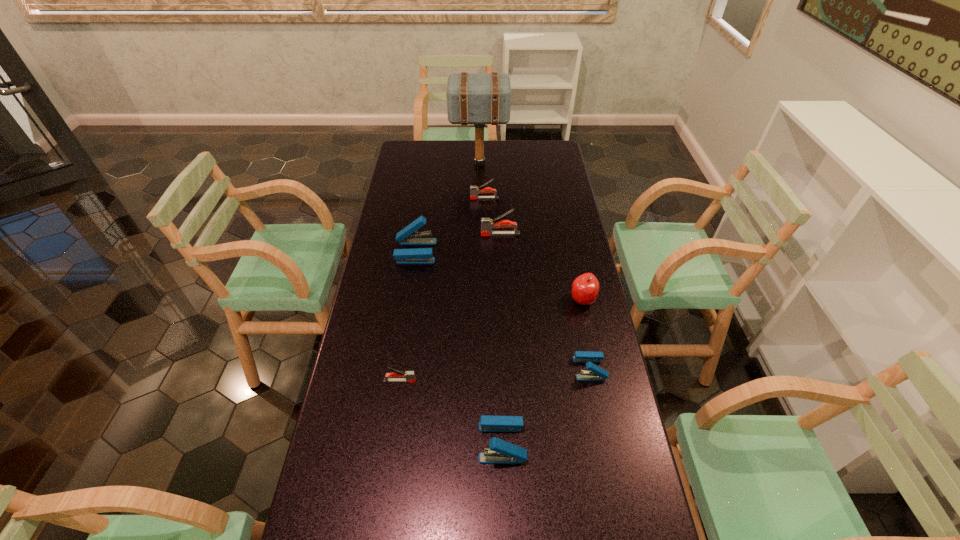
The image size is (960, 540). Identify the location of vacant space in between the second nearest blue stapler and the farthest object. (535, 266).

The width and height of the screenshot is (960, 540). Find the location of `vacant space that's between the smallest gray stapler and the tallest object`. vacant space that's between the smallest gray stapler and the tallest object is located at coordinates click(x=440, y=273).

Locate an element on the screen. unoccupied position between the third farthest stapler and the farthest stapler is located at coordinates (450, 225).

Identify which object is the closest to the second smallest blue stapler. Please provide its 2D coordinates. Your answer should be formatted as a tuple, i.e. [(x, y)], where the tuple contains the x and y coordinates of a point satisfying the conditions above.

[(596, 373)]

Select which object appears as the second closest to the fifth nearest stapler. Please provide its 2D coordinates. Your answer should be formatted as a tuple, i.e. [(x, y)], where the tuple contains the x and y coordinates of a point satisfying the conditions above.

[(474, 191)]

The width and height of the screenshot is (960, 540). Identify the location of the sixth closest stapler to the fifth farthest object. (474, 191).

Select which stapler is the closest to the farthest object. Please provide its 2D coordinates. Your answer should be formatted as a tuple, i.e. [(x, y)], where the tuple contains the x and y coordinates of a point satisfying the conditions above.

[(474, 191)]

The height and width of the screenshot is (540, 960). I want to click on gray stapler that stands as the closest to the fifth farthest object, so click(x=487, y=224).

Image resolution: width=960 pixels, height=540 pixels. I want to click on gray stapler that is the third closest to the nearest object, so tap(474, 191).

Point out which blue stapler is positioned as the nearest to the nearest gray stapler. Please provide its 2D coordinates. Your answer should be formatted as a tuple, i.e. [(x, y)], where the tuple contains the x and y coordinates of a point satisfying the conditions above.

[(500, 451)]